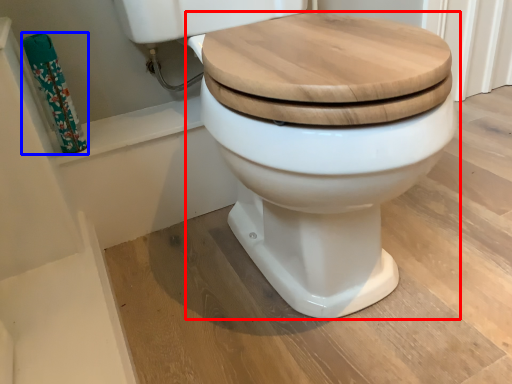
Question: Which object is closer to the camera taking this photo, toilet (highlighted by a red box) or toilet paper (highlighted by a blue box)?

Choices:
 (A) toilet
 (B) toilet paper

Answer: (A)